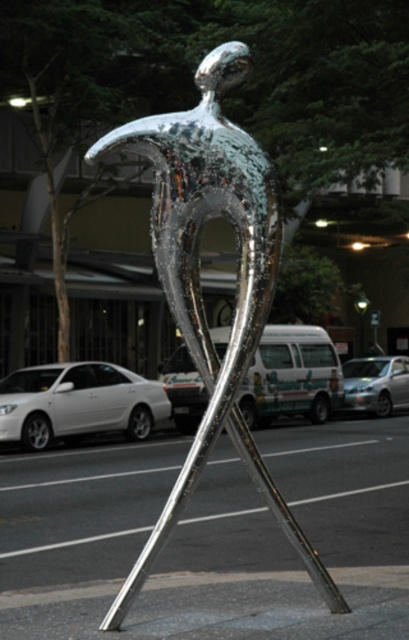
Is shiny metallic sculpture at center smaller than silver metallic car at left?

Indeed, shiny metallic sculpture at center has a smaller size compared to silver metallic car at left.

Is shiny metallic sculpture at center taller than silver metallic car at left?

Indeed, shiny metallic sculpture at center has a greater height compared to silver metallic car at left.

The image size is (409, 640). In order to click on shiny metallic sculpture at center in this screenshot , I will do `click(199, 284)`.

Where is `shiny metallic sculpture at center`? Image resolution: width=409 pixels, height=640 pixels. shiny metallic sculpture at center is located at coordinates (199, 284).

Is point (336, 605) positioned in front of point (281, 404)?

Yes, it is in front of point (281, 404).

This screenshot has height=640, width=409. What do you see at coordinates (199, 284) in the screenshot?
I see `shiny metallic sculpture at center` at bounding box center [199, 284].

Which is behind, point (276, 500) or point (316, 371)?

The point (316, 371) is behind.

The image size is (409, 640). Identify the location of shiny metallic sculpture at center. (199, 284).

At what (x,y) coordinates should I click in order to perform the action: click on silver metallic car at left. Please return your answer as a coordinate pair (x, y). The image size is (409, 640). Looking at the image, I should click on (x=78, y=403).

Who is more forward, (83, 392) or (314, 416)?

Positioned in front is point (83, 392).

Locate an element on the screen. The width and height of the screenshot is (409, 640). silver metallic car at left is located at coordinates (78, 403).

The image size is (409, 640). Find the location of `silver metallic car at left`. silver metallic car at left is located at coordinates (78, 403).